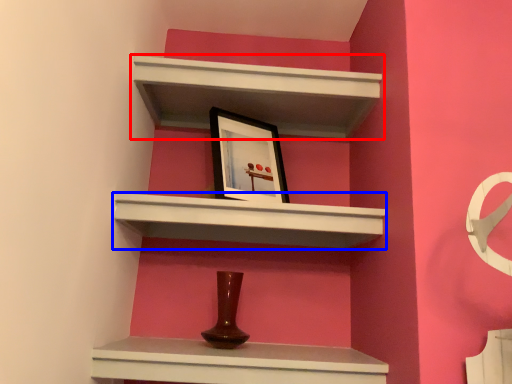
Question: Which of the following is the farthest to the observer, shelf (highlighted by a red box) or shelf (highlighted by a blue box)?

Choices:
 (A) shelf
 (B) shelf

Answer: (A)